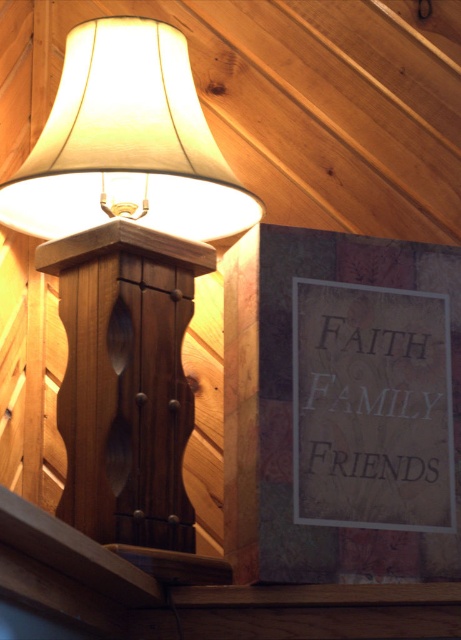
You are standing in a cabin and want to hang a new picture between the wooden carved pillar at upper left and the white paper sign at upper right. Based on their positions, where should you place the new picture to ensure it is centered between them?

The wooden carved pillar at upper left is located above the white paper sign at upper right. To center the new picture between them, position it halfway between the two objects vertically, so it sits in the middle of the vertical space separating the pillar and the sign.

You are standing in the cabin and want to hang a new picture between the wooden table lamp at upper left and the white paper sign at upper right. Based on their positions, which object is closer to you, making it easier to reach?

The wooden table lamp at upper left is in front of the white paper sign at upper right, so it is closer to you and easier to reach.

You are standing in the room and want to place a new painting on the wall. The painting must be placed to the left of the wooden carved pillar at upper left. Is there enough space for the painting?

The wooden carved pillar at upper left is located at point (125, 380). Since the pillar is already at the upper left, there may not be sufficient space to place the painting to its left without exceeding the wall boundaries. Please check the wall dimensions.